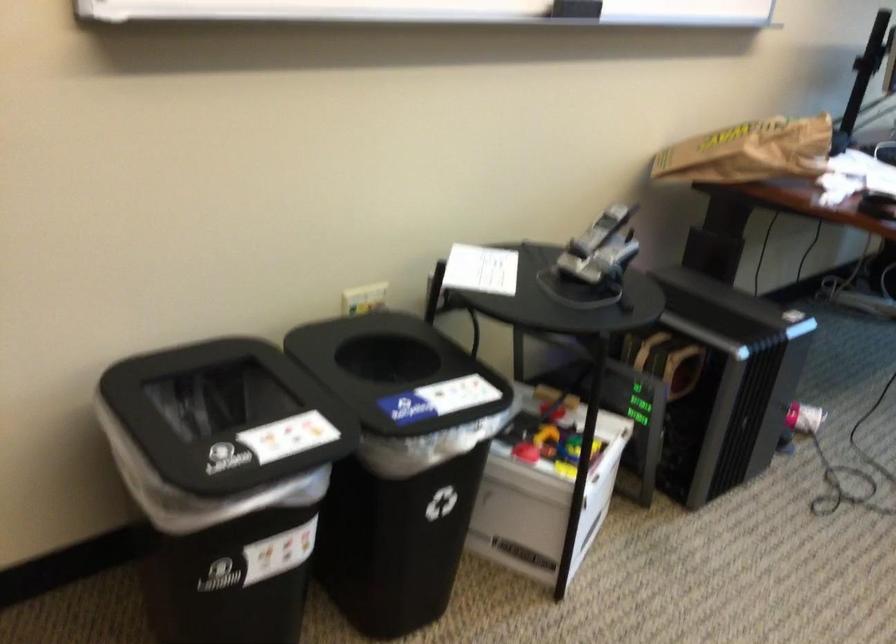
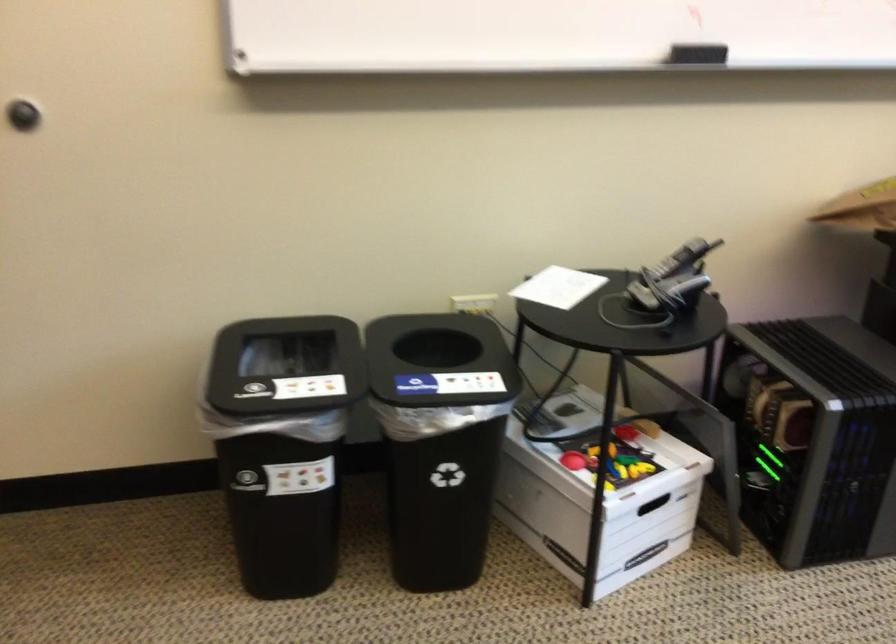
In the second image, find the point that corresponds to the point at 573,482 in the first image.

(599, 495)